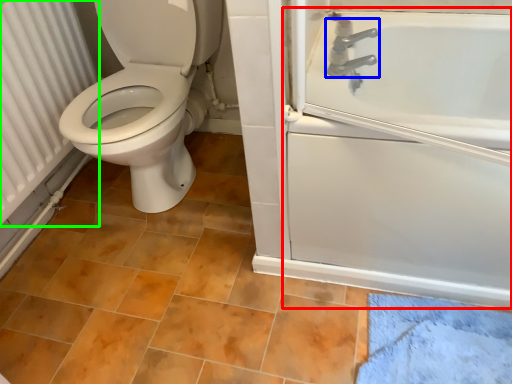
Question: Considering the real-world distances, which object is closest to bath (highlighted by a red box)? tap (highlighted by a blue box) or radiator (highlighted by a green box).

Choices:
 (A) tap
 (B) radiator

Answer: (A)